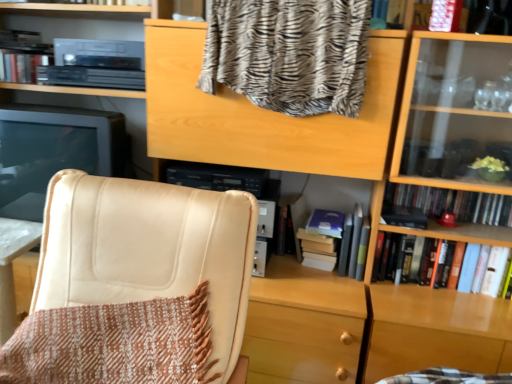
This screenshot has width=512, height=384. What are the coordinates of `free location above hardcover book at right, which appears as the 4th book when viewed from the top (from a real-world perspective)` in the screenshot? It's located at (464, 241).